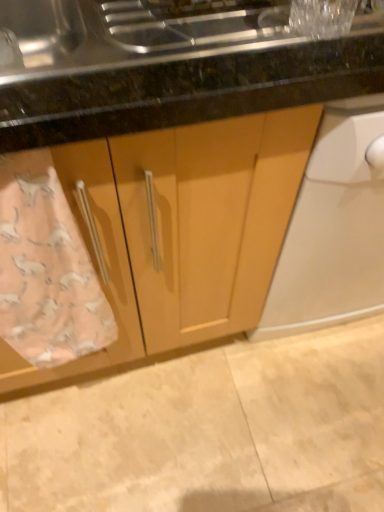
Question: From the image's perspective, relative to pink fabric towel at lower left, is matte wood cabinet at center above or below?

Choices:
 (A) above
 (B) below

Answer: (A)

Question: Relative to pink fabric towel at lower left, is matte wood cabinet at center in front or behind?

Choices:
 (A) behind
 (B) front

Answer: (B)

Question: Estimate the real-world distances between objects in this image. Which object is farther from the beige tile floor at lower center?

Choices:
 (A) matte wood cabinet at center
 (B) pink fabric towel at lower left

Answer: (B)

Question: Which of these objects is positioned farthest from the pink fabric towel at lower left?

Choices:
 (A) matte wood cabinet at center
 (B) beige tile floor at lower center

Answer: (B)